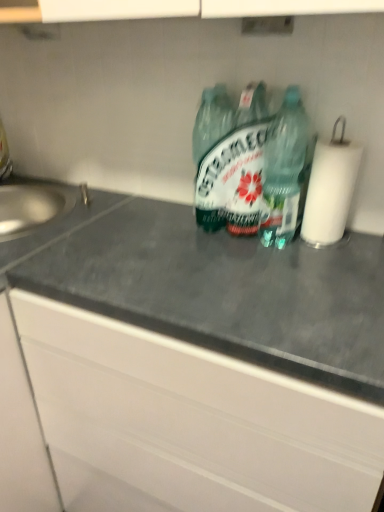
Identify the location of free space above gray matte countertop at center (from a real-world perspective). (231, 256).